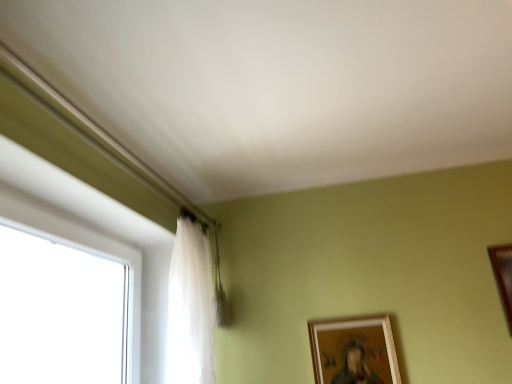
Question: Is the surface of wooden picture frame at right, which is counted as the 1th picture frame, starting from the right, in direct contact with wooden picture frame at lower right, acting as the second picture frame starting from the right?

Choices:
 (A) no
 (B) yes

Answer: (A)

Question: Could you tell me if wooden picture frame at right, positioned as the 1th picture frame in top-to-bottom order, is facing wooden picture frame at lower right, which appears as the first picture frame when ordered from the bottom?

Choices:
 (A) yes
 (B) no

Answer: (B)

Question: From the image's perspective, is wooden picture frame at right, which ranks as the second picture frame in bottom-to-top order, above wooden picture frame at lower right, the 2th picture frame in the top-to-bottom sequence?

Choices:
 (A) no
 (B) yes

Answer: (B)

Question: Is wooden picture frame at lower right, arranged as the first picture frame when viewed from the left, located within wooden picture frame at right, which is counted as the 1th picture frame, starting from the right?

Choices:
 (A) yes
 (B) no

Answer: (B)

Question: Is wooden picture frame at right, which is counted as the 1th picture frame, starting from the right, thinner than wooden picture frame at lower right, the 2th picture frame in the top-to-bottom sequence?

Choices:
 (A) yes
 (B) no

Answer: (A)

Question: Are wooden picture frame at right, which is counted as the second picture frame, starting from the left, and wooden picture frame at lower right, acting as the second picture frame starting from the right, located far from each other?

Choices:
 (A) yes
 (B) no

Answer: (B)

Question: Is translucent fabric curtain at left further to camera compared to wooden picture frame at right, which ranks as the second picture frame in bottom-to-top order?

Choices:
 (A) yes
 (B) no

Answer: (B)

Question: From a real-world perspective, is translucent fabric curtain at left on wooden picture frame at right, which is counted as the second picture frame, starting from the left?

Choices:
 (A) yes
 (B) no

Answer: (A)

Question: Is wooden picture frame at right, which is counted as the 1th picture frame, starting from the right, surrounded by translucent fabric curtain at left?

Choices:
 (A) no
 (B) yes

Answer: (A)

Question: Does translucent fabric curtain at left have a smaller size compared to wooden picture frame at right, which is counted as the second picture frame, starting from the left?

Choices:
 (A) no
 (B) yes

Answer: (A)

Question: Is translucent fabric curtain at left positioned with its back to wooden picture frame at right, which is counted as the second picture frame, starting from the left?

Choices:
 (A) yes
 (B) no

Answer: (B)

Question: From a real-world perspective, is translucent fabric curtain at left positioned under wooden picture frame at right, which ranks as the second picture frame in bottom-to-top order, based on gravity?

Choices:
 (A) yes
 (B) no

Answer: (B)

Question: Are wooden picture frame at lower right, arranged as the first picture frame when viewed from the left, and wooden picture frame at right, which is counted as the second picture frame, starting from the left, making contact?

Choices:
 (A) no
 (B) yes

Answer: (A)